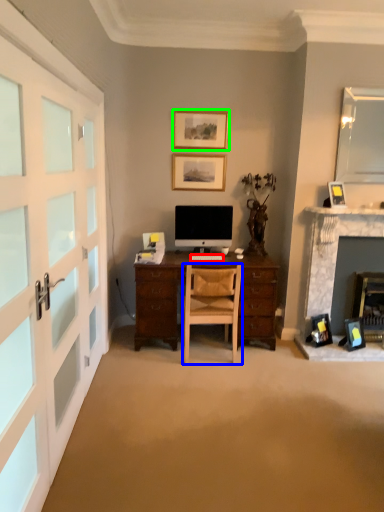
Question: Estimate the real-world distances between objects in this image. Which object is closer to computer keyboard (highlighted by a red box), chair (highlighted by a blue box) or picture frame (highlighted by a green box)?

Choices:
 (A) chair
 (B) picture frame

Answer: (A)